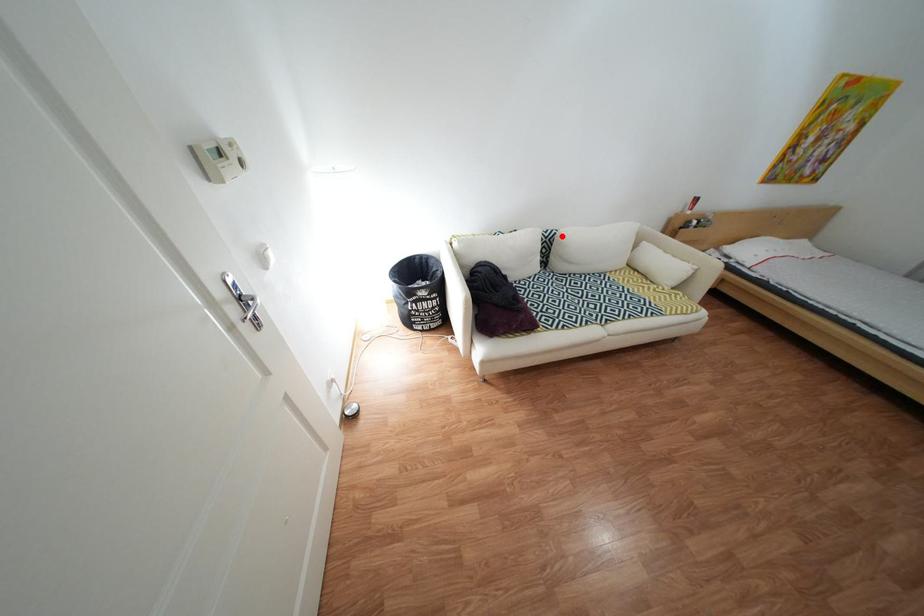
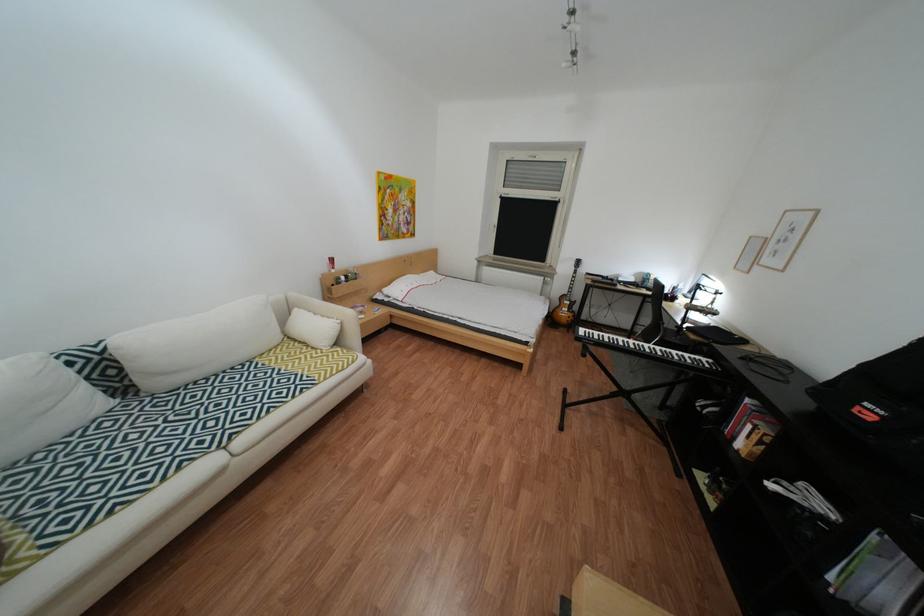
In the second image, find the point that corresponds to the highlighted location in the first image.

(114, 351)